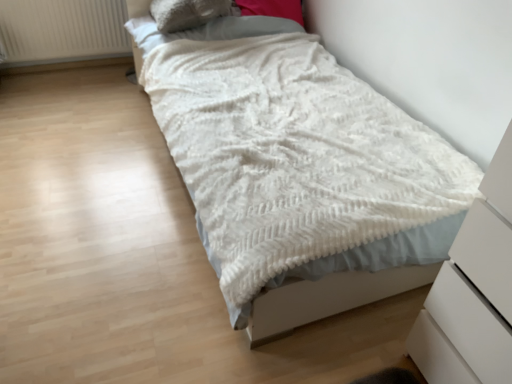
Where is `vacant space in white textured radiator at upper left (from a real-world perspective)`? The width and height of the screenshot is (512, 384). vacant space in white textured radiator at upper left (from a real-world perspective) is located at coordinates (71, 69).